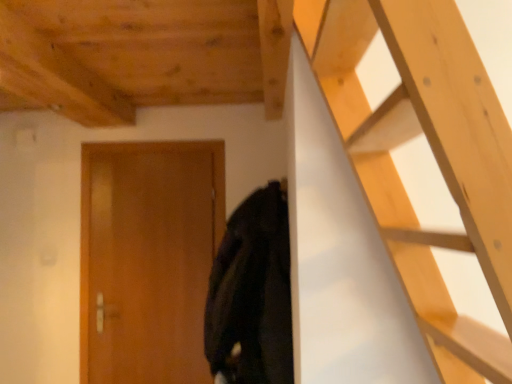
Question: Based on their sizes in the image, would you say wooden at upper right is bigger or smaller than black matte coat at center?

Choices:
 (A) big
 (B) small

Answer: (A)

Question: Is point (433, 344) positioned closer to the camera than point (252, 213)?

Choices:
 (A) farther
 (B) closer

Answer: (B)

Question: Estimate the real-world distances between objects in this image. Which object is farther from the wooden at upper right?

Choices:
 (A) black matte coat at center
 (B) wooden door at center

Answer: (B)

Question: Which of these objects is positioned closest to the wooden at upper right?

Choices:
 (A) black matte coat at center
 (B) wooden door at center

Answer: (A)